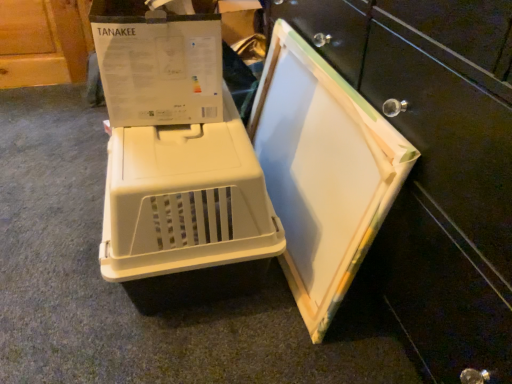
In order to click on free location in front of beige plastic crate at center in this screenshot , I will do `click(163, 341)`.